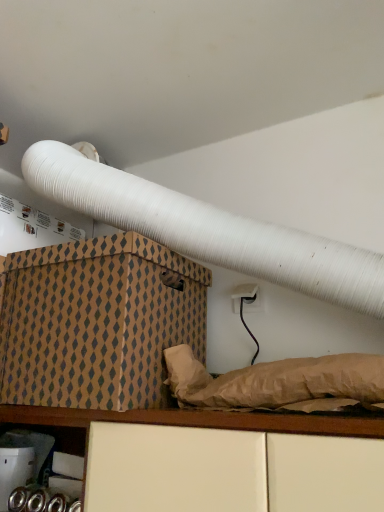
Question: Is brown cardboard box at lower left inside the boundaries of metallic silver canisters at lower left, or outside?

Choices:
 (A) inside
 (B) outside

Answer: (B)

Question: Based on their positions, is brown cardboard box at lower left located to the left or right of metallic silver canisters at lower left?

Choices:
 (A) right
 (B) left

Answer: (A)

Question: From the image's perspective, is brown cardboard box at lower left positioned above or below metallic silver canisters at lower left?

Choices:
 (A) above
 (B) below

Answer: (A)

Question: From a real-world perspective, relative to brown cardboard box at lower left, is metallic silver canisters at lower left vertically above or below?

Choices:
 (A) below
 (B) above

Answer: (A)

Question: Considering the positions of metallic silver canisters at lower left and brown cardboard box at lower left in the image, is metallic silver canisters at lower left wider or thinner than brown cardboard box at lower left?

Choices:
 (A) thin
 (B) wide

Answer: (A)

Question: Does point [x=44, y=496] appear closer or farther from the camera than point [x=28, y=258]?

Choices:
 (A) farther
 (B) closer

Answer: (A)

Question: Is metallic silver canisters at lower left bigger or smaller than brown cardboard box at lower left?

Choices:
 (A) big
 (B) small

Answer: (B)